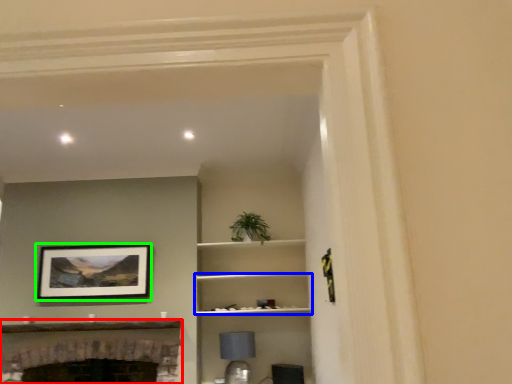
Question: Which object is positioned farthest from fireplace (highlighted by a red box)? Select from shelf (highlighted by a blue box) and picture frame (highlighted by a green box).

Choices:
 (A) shelf
 (B) picture frame

Answer: (A)